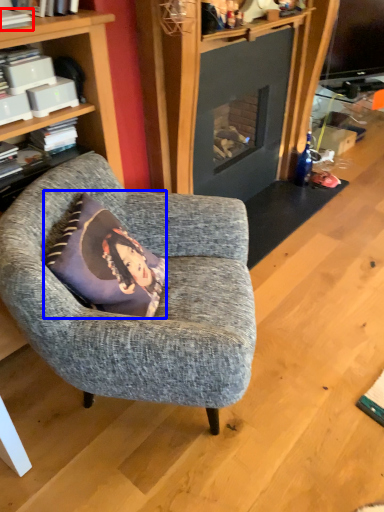
Question: Which object is further to the camera taking this photo, book (highlighted by a red box) or pillow (highlighted by a blue box)?

Choices:
 (A) book
 (B) pillow

Answer: (A)